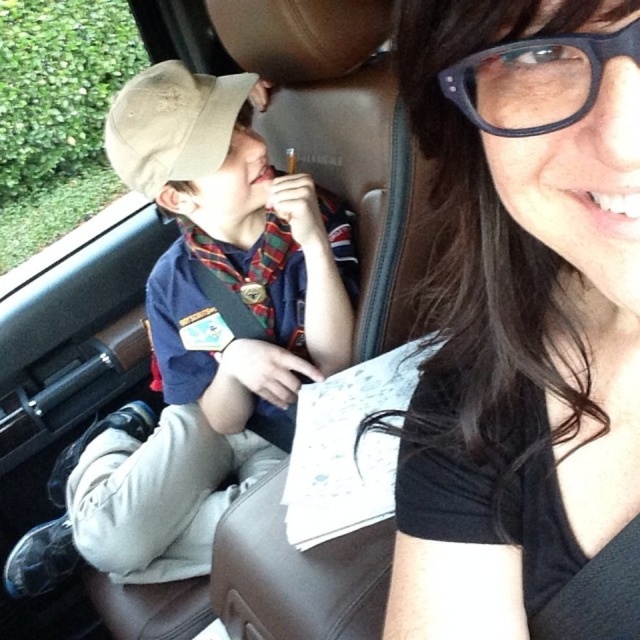
Question: Estimate the real-world distances between objects in this image. Which object is farther from the tan fabric baseball cap at left?

Choices:
 (A) black matte glasses at upper right
 (B) matte khaki cap at left

Answer: (A)

Question: Is black matte glasses at upper right to the left of tan fabric baseball cap at left from the viewer's perspective?

Choices:
 (A) no
 (B) yes

Answer: (A)

Question: Does matte khaki cap at left lie behind black plastic glasses at upper right?

Choices:
 (A) yes
 (B) no

Answer: (A)

Question: Which object is closer to the camera taking this photo?

Choices:
 (A) tan fabric baseball cap at left
 (B) matte khaki cap at left

Answer: (B)

Question: Which point is farther to the camera?

Choices:
 (A) (481, 104)
 (B) (248, 157)

Answer: (B)

Question: Where is black matte glasses at upper right located in relation to tan fabric baseball cap at left in the image?

Choices:
 (A) right
 (B) left

Answer: (A)